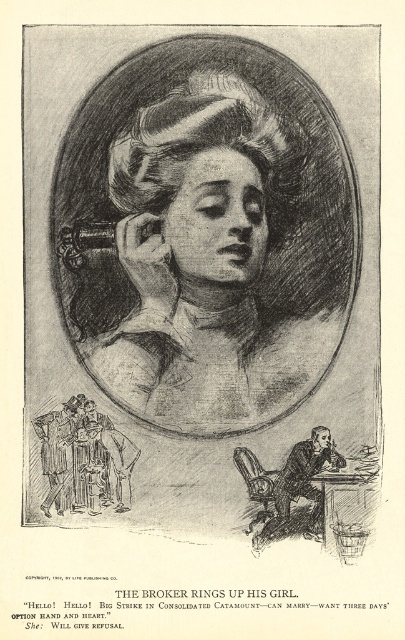
Question: Based on their relative distances, which object is nearer to the smooth paper-like face at center?

Choices:
 (A) smooth skin head at center
 (B) smooth skin head at lower right

Answer: (A)

Question: Does matte black hair at center have a greater width compared to smooth skin head at center?

Choices:
 (A) no
 (B) yes

Answer: (B)

Question: Among these points, which one is farthest from the camera?

Choices:
 (A) click(179, 144)
 (B) click(313, 433)

Answer: (A)

Question: Observing the image, what is the correct spatial positioning of smooth paper-like face at center in reference to smooth skin head at center?

Choices:
 (A) below
 (B) above

Answer: (B)

Question: Is smooth paper-like face at center positioned before smooth paper desk at lower right?

Choices:
 (A) yes
 (B) no

Answer: (B)

Question: Which is farther from the smooth skin head at lower right?

Choices:
 (A) smooth skin head at center
 (B) matte black hair at center

Answer: (B)